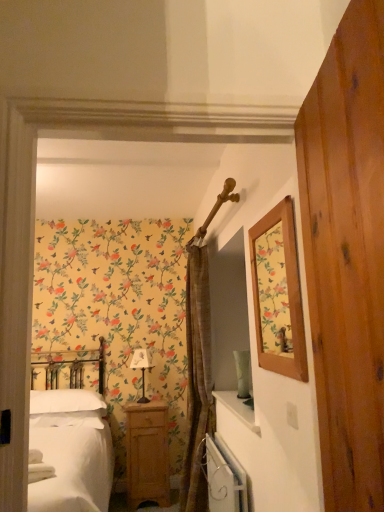
Question: Is white metallic radiator at lower center wider than white fabric-covered lampshade at center?

Choices:
 (A) yes
 (B) no

Answer: (B)

Question: Is white metallic radiator at lower center closer to camera compared to white fabric-covered lampshade at center?

Choices:
 (A) yes
 (B) no

Answer: (A)

Question: Does white metallic radiator at lower center turn towards white fabric-covered lampshade at center?

Choices:
 (A) no
 (B) yes

Answer: (A)

Question: From the image's perspective, would you say white metallic radiator at lower center is shown under white fabric-covered lampshade at center?

Choices:
 (A) no
 (B) yes

Answer: (B)

Question: Is white metallic radiator at lower center beside white fabric-covered lampshade at center?

Choices:
 (A) no
 (B) yes

Answer: (A)

Question: Is white metallic radiator at lower center positioned beyond the bounds of white fabric-covered lampshade at center?

Choices:
 (A) yes
 (B) no

Answer: (A)

Question: Is wooden barn door at right outside white soft pillow at lower left?

Choices:
 (A) yes
 (B) no

Answer: (A)

Question: Considering the relative sizes of wooden barn door at right and white soft pillow at lower left in the image provided, is wooden barn door at right bigger than white soft pillow at lower left?

Choices:
 (A) no
 (B) yes

Answer: (A)

Question: Is white soft pillow at lower left completely or partially inside wooden barn door at right?

Choices:
 (A) no
 (B) yes

Answer: (A)

Question: Could you tell me if wooden barn door at right is facing white soft pillow at lower left?

Choices:
 (A) no
 (B) yes

Answer: (A)

Question: Is wooden barn door at right placed right next to white soft pillow at lower left?

Choices:
 (A) no
 (B) yes

Answer: (A)

Question: Can you confirm if wooden barn door at right is positioned to the right of white soft pillow at lower left?

Choices:
 (A) no
 (B) yes

Answer: (B)

Question: Is white soft pillow at lower left aimed at white fabric-covered lampshade at center?

Choices:
 (A) no
 (B) yes

Answer: (A)